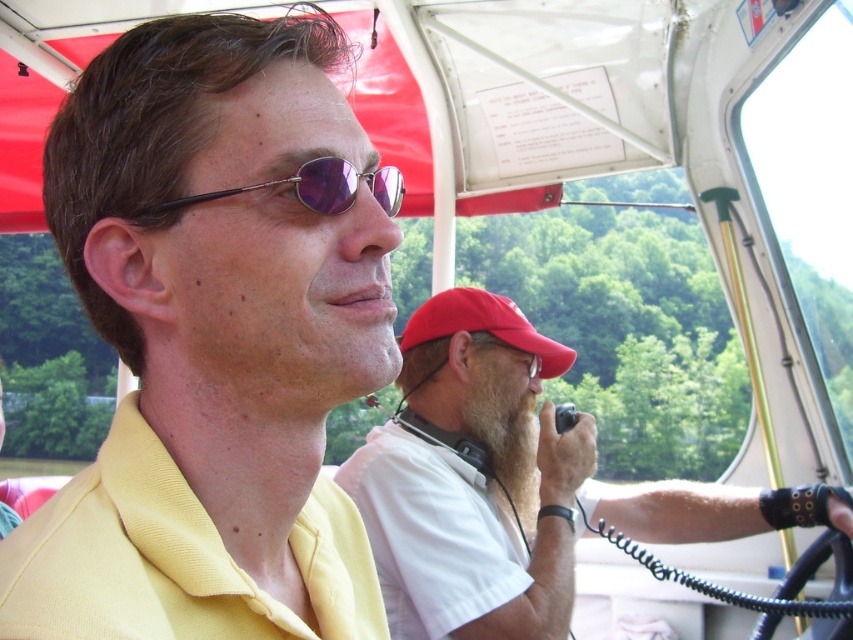
Question: In this image, where is white matte shirt at center located relative to metallic purple sunglasses at center?

Choices:
 (A) above
 (B) below

Answer: (B)

Question: Does yellow matte shirt at upper left lie behind metallic purple sunglasses at center?

Choices:
 (A) no
 (B) yes

Answer: (A)

Question: Which object is closer to the camera taking this photo?

Choices:
 (A) white matte shirt at center
 (B) yellow matte shirt at upper left
 (C) metallic purple sunglasses at center
 (D) red fabric baseball cap at upper right

Answer: (B)

Question: Which object is the farthest from the metallic purple sunglasses at center?

Choices:
 (A) red fabric baseball cap at upper right
 (B) white matte shirt at center
 (C) yellow matte shirt at upper left

Answer: (A)

Question: Does yellow matte shirt at upper left have a smaller size compared to metallic purple sunglasses at center?

Choices:
 (A) yes
 (B) no

Answer: (B)

Question: Which is nearer to the yellow matte shirt at upper left?

Choices:
 (A) metallic purple sunglasses at center
 (B) white matte shirt at center

Answer: (A)